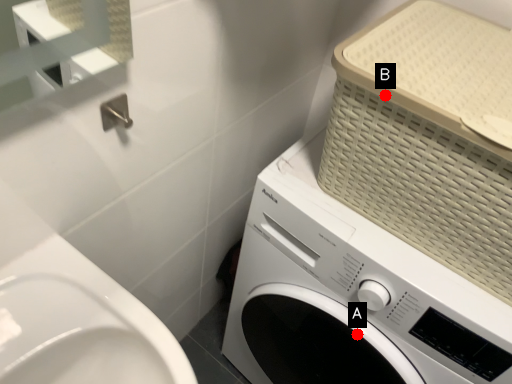
Question: Two points are circled on the image, labeled by A and B beside each circle. Which point appears closest to the camera in this image?

Choices:
 (A) A is closer
 (B) B is closer

Answer: (B)